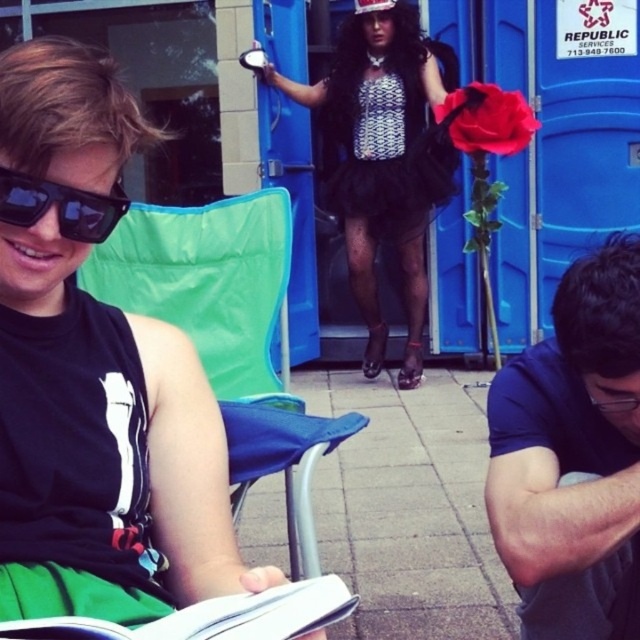
You are a photographer taking a picture of the black tulle skirt at center and the white paper book at lower left. Which object should you focus on first to ensure both are in sharp focus?

You should focus on the black tulle skirt at center first because it is closer to the viewer than the white paper book at lower left, so starting with the closer object will help achieve focus on both.